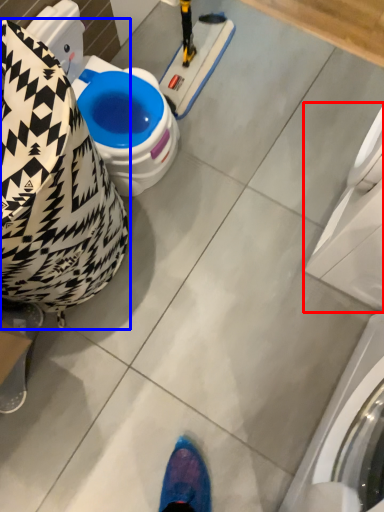
Question: Which object is closer to the camera taking this photo, washing machine (highlighted by a red box) or bean bag chair (highlighted by a blue box)?

Choices:
 (A) washing machine
 (B) bean bag chair

Answer: (A)